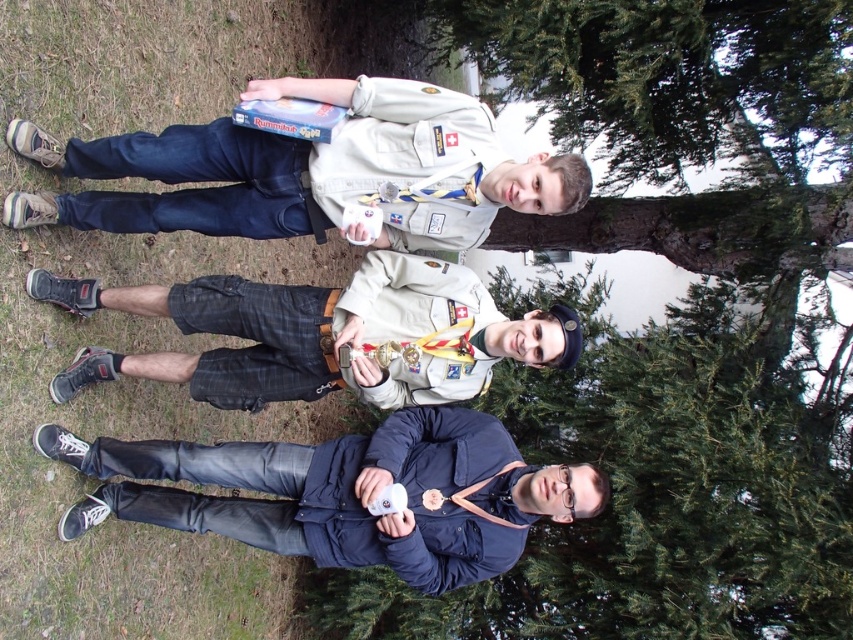
In the scene with three people standing in front of a tree, there are two individuals wearing the matte khaki uniform at center and the matte black shorts at center. According to their positions, which one is located to the left?

The matte khaki uniform at center is to the left of the matte black shorts at center.

You are standing in the scene and want to hand a small item to both the matte khaki uniform at center and the dark blue fabric jacket at lower center. Which person should you approach first to ensure you can reach them without moving closer?

You should first approach the matte khaki uniform at center because it is closer to you than the dark blue fabric jacket at lower center, so you can reach them without needing to move closer.